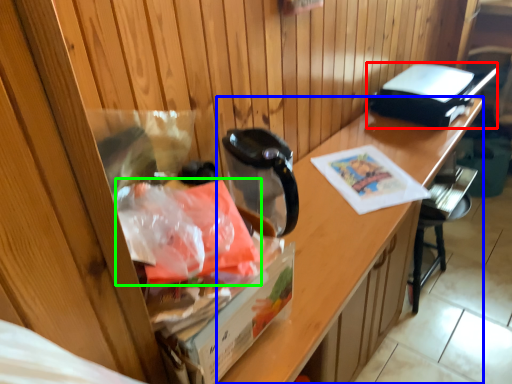
Question: Which object is positioned closest to appliance (highlighted by a red box)? Select from desk (highlighted by a blue box) and material (highlighted by a green box).

Choices:
 (A) desk
 (B) material

Answer: (A)